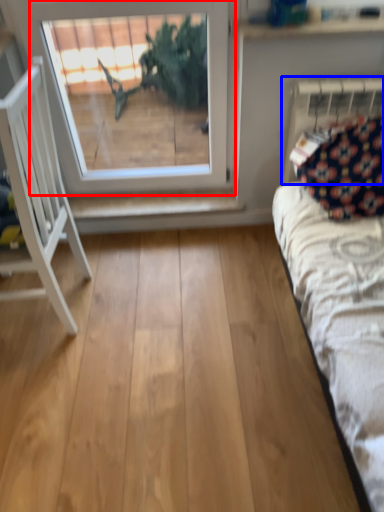
Question: Among these objects, which one is farthest to the camera, window (highlighted by a red box) or radiator (highlighted by a blue box)?

Choices:
 (A) window
 (B) radiator

Answer: (B)